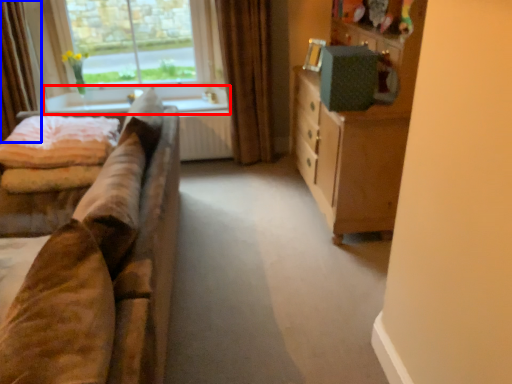
Question: Which of the following is the closest to the observer, window sill (highlighted by a red box) or curtain (highlighted by a blue box)?

Choices:
 (A) window sill
 (B) curtain

Answer: (B)